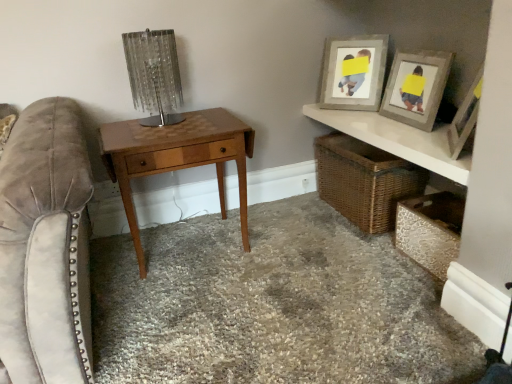
In order to face metallic textured chest at lower right, the second shelf positioned from the top, should I rotate leftwards or rightwards?

Rotate right and turn 24.700 degrees.

Find the location of a particular element. white glossy shelf at upper right, which ranks as the 1th shelf in top-to-bottom order is located at coordinates (397, 140).

Identify the location of wooden picture frame at upper right, the 1th picture frame positioned from the back. (353, 73).

How far apart are light brown wood table at center and carpeted floor at center?

light brown wood table at center and carpeted floor at center are 17.85 inches apart.

From the image's perspective, would you say light brown wood table at center is shown under carpeted floor at center?

No, from the image's perspective, light brown wood table at center is not below carpeted floor at center.

At what (x,y) coordinates should I click in order to perform the action: click on table located above the carpeted floor at center (from the image's perspective). Please return your answer as a coordinate pair (x, y). Looking at the image, I should click on (177, 157).

Would you consider light brown wood table at center to be distant from carpeted floor at center?

They are positioned close to each other.

Considering the sizes of objects woven brown basket at lower right and suede swivel chair at left in the image provided, who is shorter, woven brown basket at lower right or suede swivel chair at left?

With less height is woven brown basket at lower right.

Is point (380, 187) in front of point (75, 106)?

No, (380, 187) is further to viewer.

In the image, is woven brown basket at lower right positioned in front of or behind suede swivel chair at left?

Clearly, woven brown basket at lower right is behind suede swivel chair at left.

From a real-world perspective, which is physically above, woven brown basket at lower right or suede swivel chair at left?

From a 3D spatial view, suede swivel chair at left is above.

Is clear glass table lamp at upper left oriented away from wooden picture frame at upper right, the second picture frame in the front-to-back sequence?

No, wooden picture frame at upper right, the second picture frame in the front-to-back sequence, is not at the back of clear glass table lamp at upper left.

From a real-world perspective, is clear glass table lamp at upper left physically located above or below wooden picture frame at upper right, the 1th picture frame positioned from the back?

From a real-world perspective, clear glass table lamp at upper left is physically above wooden picture frame at upper right, the 1th picture frame positioned from the back.

From the image's perspective, is clear glass table lamp at upper left positioned above or below wooden picture frame at upper right, the 1th picture frame positioned from the back?

Based on their image positions, clear glass table lamp at upper left is located beneath wooden picture frame at upper right, the 1th picture frame positioned from the back.

At what (x,y) coordinates should I click in order to perform the action: click on picture frame above the clear glass table lamp at upper left (from the image's perspective). Please return your answer as a coordinate pair (x, y). Looking at the image, I should click on (353, 73).

Which is correct: white glossy shelf at upper right, which ranks as the second shelf in bottom-to-top order, is inside wooden picture frame at upper right, the second picture frame in the back-to-front sequence, or outside of it?

white glossy shelf at upper right, which ranks as the second shelf in bottom-to-top order, is not enclosed by wooden picture frame at upper right, the second picture frame in the back-to-front sequence.

What are the coordinates of `picture frame on the right of the white glossy shelf at upper right, which ranks as the second shelf in bottom-to-top order` in the screenshot? It's located at point(416,87).

Does white glossy shelf at upper right, which ranks as the second shelf in bottom-to-top order, have a lesser width compared to wooden picture frame at upper right, the second picture frame in the back-to-front sequence?

No, white glossy shelf at upper right, which ranks as the second shelf in bottom-to-top order, is not thinner than wooden picture frame at upper right, the second picture frame in the back-to-front sequence.

Could you tell me if white glossy shelf at upper right, which ranks as the 1th shelf in top-to-bottom order, is facing wooden picture frame at upper right, the first picture frame in the front-to-back sequence?

No.

From a real-world perspective, which object stands above the other?

woven brown basket at lower right, from a real-world perspective.

Does woven brown basket at lower right have a greater height compared to metallic textured chest at lower right, the second shelf positioned from the top?

Yes, woven brown basket at lower right is taller than metallic textured chest at lower right, the second shelf positioned from the top.

Based on the photo, between woven brown basket at lower right and metallic textured chest at lower right, which is counted as the first shelf, starting from the bottom, which one is positioned behind?

Positioned behind is woven brown basket at lower right.

Is woven brown basket at lower right next to metallic textured chest at lower right, which is counted as the first shelf, starting from the bottom?

No, woven brown basket at lower right is not next to metallic textured chest at lower right, which is counted as the first shelf, starting from the bottom.

Where is `table in front of the wooden picture frame at upper right, the second picture frame in the front-to-back sequence`? table in front of the wooden picture frame at upper right, the second picture frame in the front-to-back sequence is located at coordinates (177, 157).

From a real-world perspective, between light brown wood table at center and wooden picture frame at upper right, the 1th picture frame positioned from the back, who is vertically higher?

In real-world perspective, wooden picture frame at upper right, the 1th picture frame positioned from the back, is above.

Is light brown wood table at center directly adjacent to wooden picture frame at upper right, the second picture frame in the front-to-back sequence?

light brown wood table at center is not next to wooden picture frame at upper right, the second picture frame in the front-to-back sequence, and they're not touching.

Would you say light brown wood table at center is inside or outside wooden picture frame at upper right, the second picture frame in the front-to-back sequence?

light brown wood table at center is outside wooden picture frame at upper right, the second picture frame in the front-to-back sequence.

From the image's perspective, does white glossy shelf at upper right, which ranks as the 1th shelf in top-to-bottom order, appear lower than light brown wood table at center?

No, from the image's perspective, white glossy shelf at upper right, which ranks as the 1th shelf in top-to-bottom order, is not below light brown wood table at center.

Which of these two, white glossy shelf at upper right, which ranks as the second shelf in bottom-to-top order, or light brown wood table at center, stands shorter?

With less height is white glossy shelf at upper right, which ranks as the second shelf in bottom-to-top order.

Considering the sizes of white glossy shelf at upper right, which ranks as the 1th shelf in top-to-bottom order, and light brown wood table at center in the image, is white glossy shelf at upper right, which ranks as the 1th shelf in top-to-bottom order, wider or thinner than light brown wood table at center?

Clearly, white glossy shelf at upper right, which ranks as the 1th shelf in top-to-bottom order, has less width compared to light brown wood table at center.

Which is behind, point (463, 185) or point (220, 177)?

Positioned behind is point (220, 177).

Find the location of `concrete on the right of light brown wood table at center`. concrete on the right of light brown wood table at center is located at coordinates (272, 305).

This screenshot has height=384, width=512. In the image, there is a suede swivel chair at left. What are the coordinates of `basket below it (from a real-world perspective)` in the screenshot? It's located at (364, 181).

Considering their positions, is carpeted floor at center positioned closer to suede swivel chair at left than light brown wood table at center?

Based on the image, light brown wood table at center appears to be nearer to suede swivel chair at left.

Based on their spatial positions, is light brown wood table at center or white glossy shelf at upper right, which ranks as the 1th shelf in top-to-bottom order, further from woven brown basket at lower right?

light brown wood table at center is further to woven brown basket at lower right.

Looking at the image, which one is located further to woven brown basket at lower right, metallic textured chest at lower right, which is counted as the first shelf, starting from the bottom, or clear glass table lamp at upper left?

clear glass table lamp at upper left.

Based on their spatial positions, is wooden picture frame at upper right, the first picture frame in the front-to-back sequence, or carpeted floor at center closer to white glossy shelf at upper right, which ranks as the second shelf in bottom-to-top order?

wooden picture frame at upper right, the first picture frame in the front-to-back sequence.

From the image, which object appears to be nearer to metallic textured chest at lower right, the second shelf positioned from the top, white glossy shelf at upper right, which ranks as the second shelf in bottom-to-top order, or woven brown basket at lower right?

woven brown basket at lower right lies closer to metallic textured chest at lower right, the second shelf positioned from the top, than the other object.

Which object lies further to the anchor point carpeted floor at center, woven brown basket at lower right or wooden picture frame at upper right, the first picture frame in the front-to-back sequence?

wooden picture frame at upper right, the first picture frame in the front-to-back sequence, lies further to carpeted floor at center than the other object.

When comparing their distances from wooden picture frame at upper right, the 1th picture frame positioned from the back, does carpeted floor at center or suede swivel chair at left seem further?

suede swivel chair at left lies further to wooden picture frame at upper right, the 1th picture frame positioned from the back, than the other object.

In the scene shown: Looking at the image, which one is located further to clear glass table lamp at upper left, wooden picture frame at upper right, the second picture frame in the front-to-back sequence, or woven brown basket at lower right?

woven brown basket at lower right is further to clear glass table lamp at upper left.

The width and height of the screenshot is (512, 384). I want to click on table between suede swivel chair at left and wooden picture frame at upper right, the 1th picture frame positioned from the back, from left to right, so click(177, 157).

At what (x,y) coordinates should I click in order to perform the action: click on concrete between clear glass table lamp at upper left and wooden picture frame at upper right, the first picture frame in the front-to-back sequence. Please return your answer as a coordinate pair (x, y). Looking at the image, I should click on (272, 305).

Identify the location of picture frame located between clear glass table lamp at upper left and wooden picture frame at upper right, the second picture frame in the back-to-front sequence, in the left-right direction. Image resolution: width=512 pixels, height=384 pixels. (353, 73).

Locate an element on the screen. table lamp located between suede swivel chair at left and wooden picture frame at upper right, the first picture frame in the front-to-back sequence, in the left-right direction is located at coordinates (154, 75).